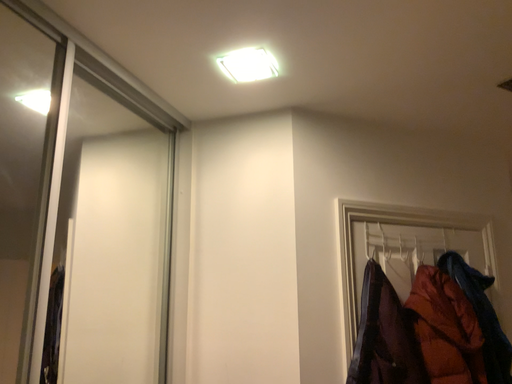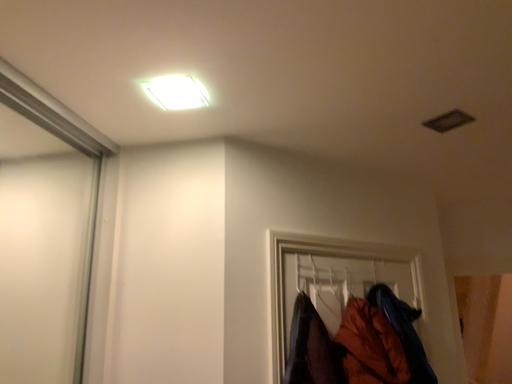
Question: Which way did the camera rotate in the video?

Choices:
 (A) rotated left
 (B) rotated right

Answer: (B)